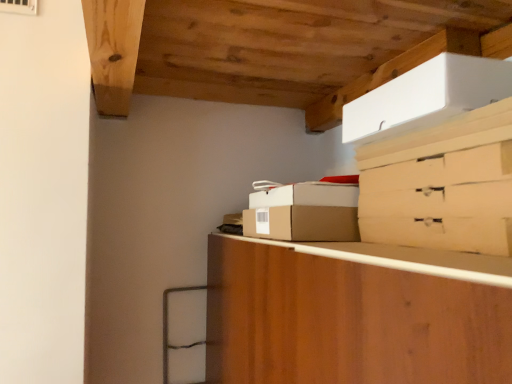
Question: Is wooden cabinet at center inside or outside of brown cardboard box at center, which appears as the second cardboard box when viewed from the top?

Choices:
 (A) inside
 (B) outside

Answer: (B)

Question: Considering the relative positions of wooden cabinet at center and brown cardboard box at center, which appears as the second cardboard box when viewed from the top, in the image provided, is wooden cabinet at center to the left or to the right of brown cardboard box at center, which appears as the second cardboard box when viewed from the top,?

Choices:
 (A) right
 (B) left

Answer: (A)

Question: Which object is positioned closest to the brown cardboard box at center, which is the 3th cardboard box in top-to-bottom order?

Choices:
 (A) wooden cabinet at center
 (B) brown cardboard box at center, placed as the 2th cardboard box when sorted from bottom to top
 (C) matte cardboard drawer at upper right
 (D) white cardboard box at upper right, the first cardboard box in the top-to-bottom sequence

Answer: (B)

Question: Estimate the real-world distances between objects in this image. Which object is farther from the matte cardboard drawer at upper right?

Choices:
 (A) brown cardboard box at center, which is the 3th cardboard box in top-to-bottom order
 (B) white cardboard box at upper right, the first cardboard box in the top-to-bottom sequence
 (C) brown cardboard box at center, which appears as the second cardboard box when viewed from the top
 (D) wooden cabinet at center

Answer: (D)